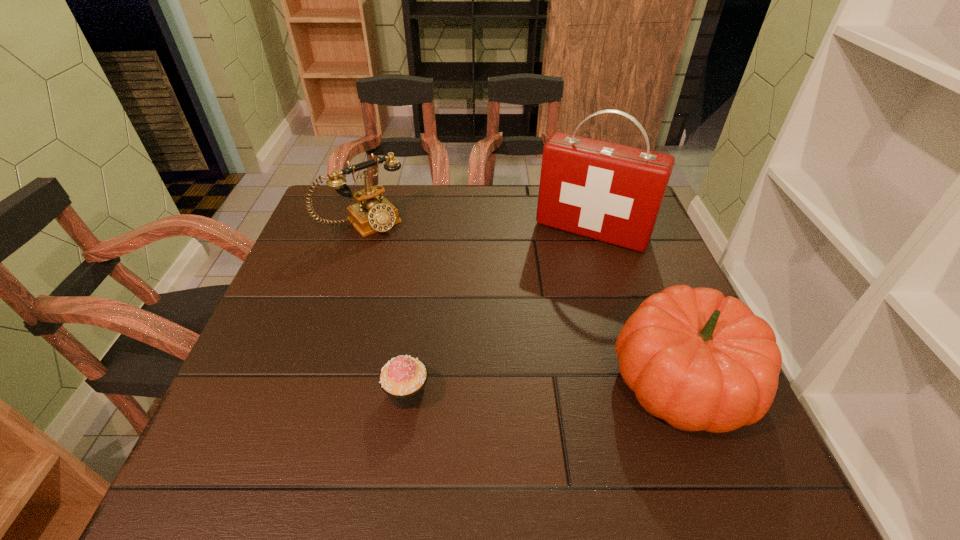
Image resolution: width=960 pixels, height=540 pixels. I want to click on free region that satisfies the following two spatial constraints: 1. on the front side of the tallest object; 2. on the left side of the telephone, so click(361, 231).

The image size is (960, 540). In order to click on vacant position in the image that satisfies the following two spatial constraints: 1. on the front side of the tallest object; 2. on the left side of the telephone in this screenshot , I will do `click(361, 231)`.